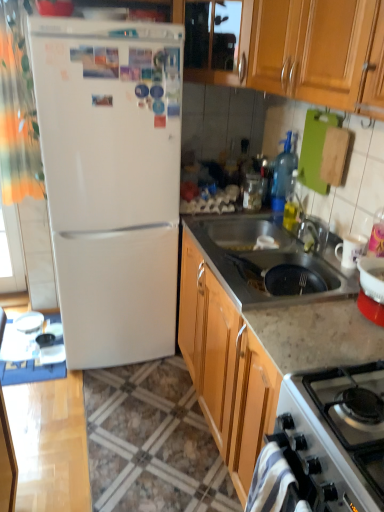
The width and height of the screenshot is (384, 512). Identify the location of vacant space underneath orange fabric curtain at left (from a real-world perspective). (41, 328).